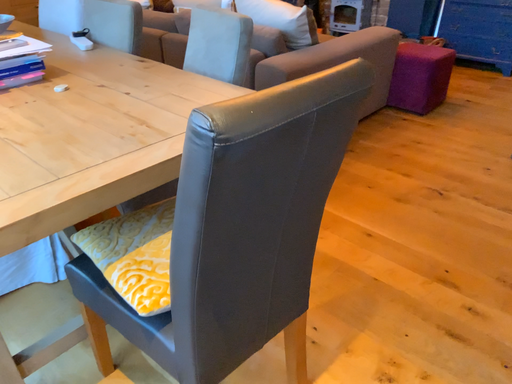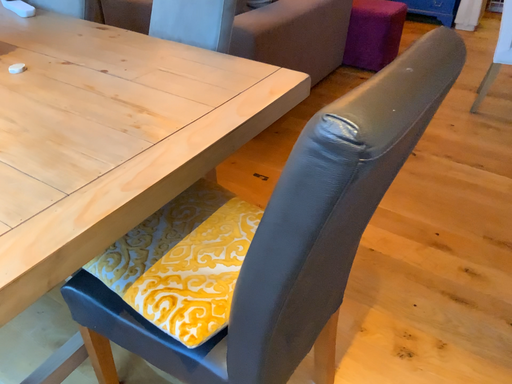
Question: How did the camera likely rotate when shooting the video?

Choices:
 (A) rotated right
 (B) rotated left

Answer: (A)